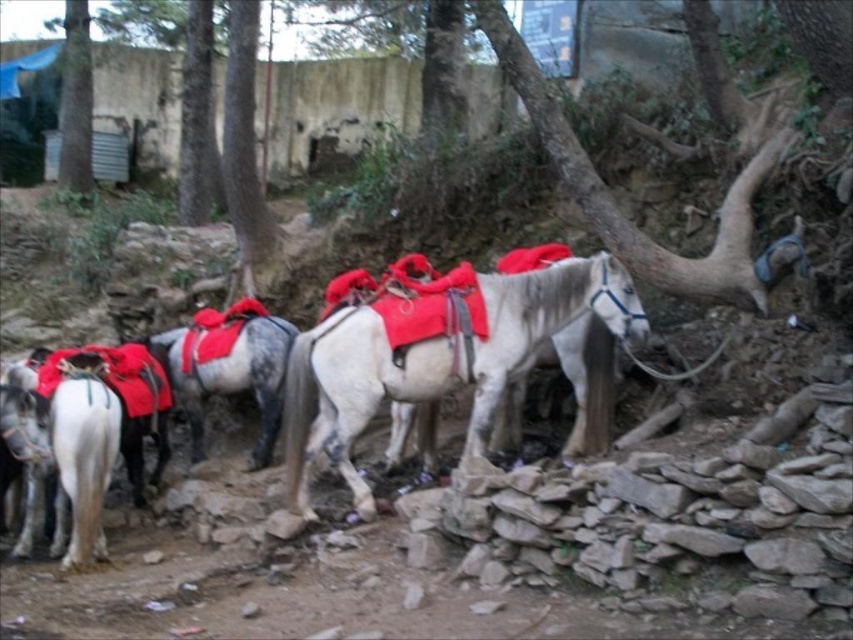
You are a hiker who wants to take a photo of the rough bark tree at center right. You are standing at the point with coordinates point (618, 204). Is the rough bark tree at center right in front of or behind you?

The rough bark tree at center right is represented by point (618, 204), so you are standing exactly at the location of the rough bark tree at center right. Therefore, you cannot see it in front or behind you because you are at its location.

Based on the photo, you are a hiker who has just arrived at this location. You need to locate the rough bark tree at center right. According to the coordinates provided, where should you look to find it?

The rough bark tree at center right is located at coordinates point (618, 204).